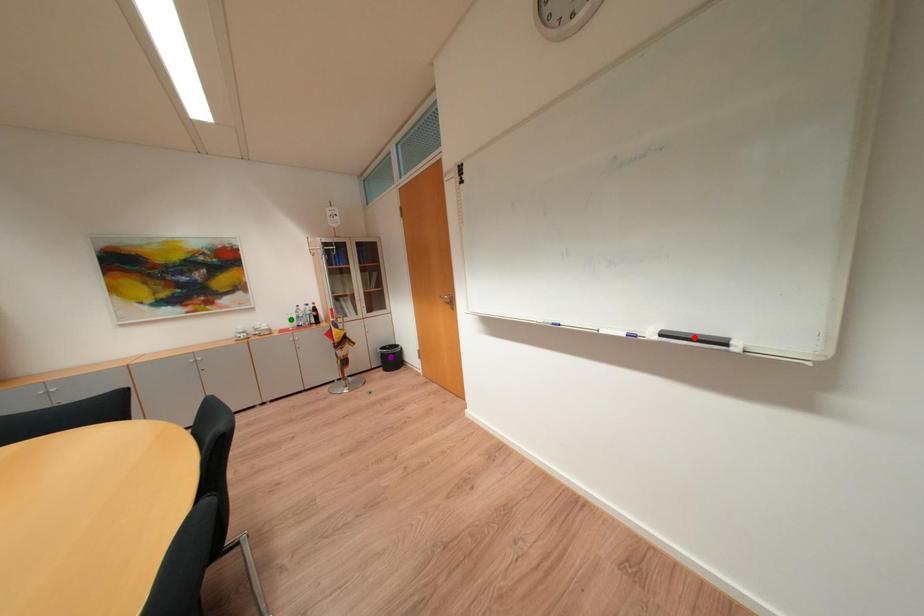
Order these from nearest to farthest:
A) purple point
B) red point
C) green point

red point, green point, purple point